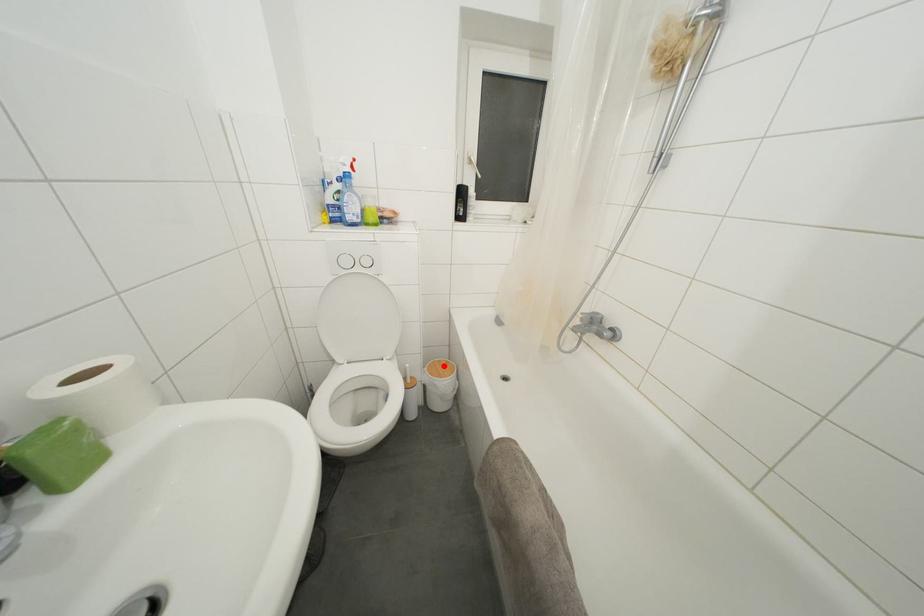
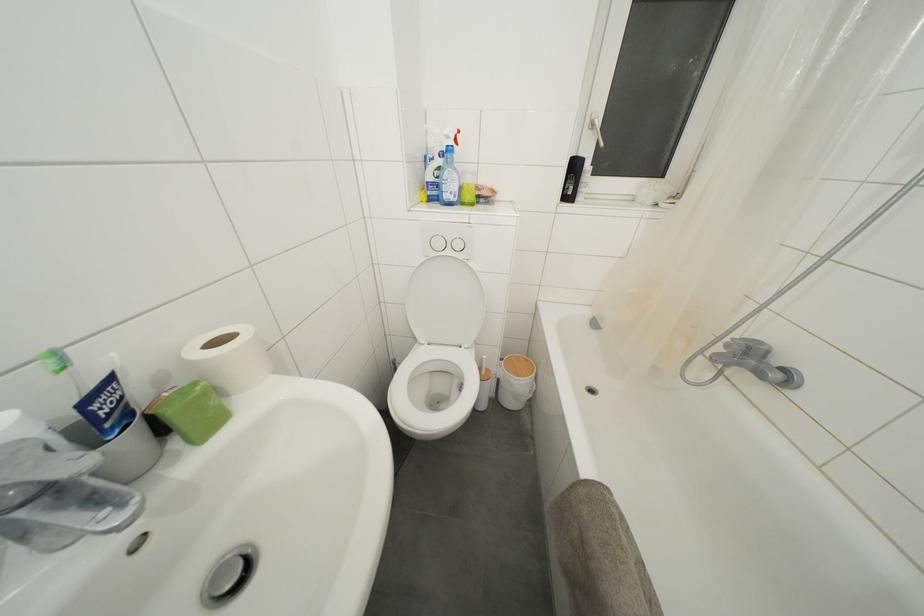
Locate, in the second image, the point that corresponds to the highlighted location in the first image.

(521, 362)